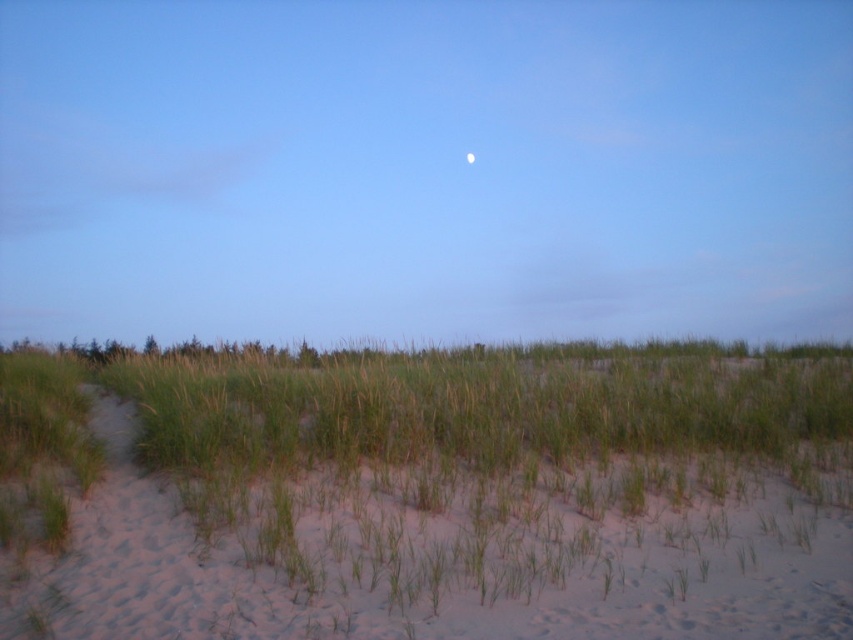
Where is `green grass at center`? Image resolution: width=853 pixels, height=640 pixels. green grass at center is located at coordinates (427, 496).

Is point (204, 573) in front of point (467, 161)?

Yes, point (204, 573) is in front of point (467, 161).

Locate an element on the screen. green grass at center is located at coordinates (427, 496).